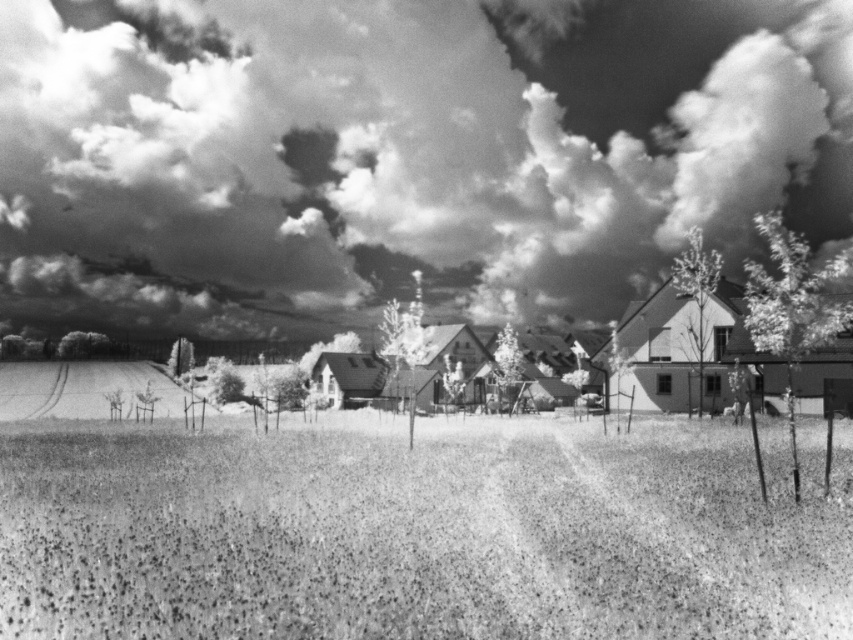
Looking at the rural landscape, you notice the cloudy sky at upper center and the grainy grass at center. Which of these two elements has a greater width in the image?

The cloudy sky at upper center has a greater width than the grainy grass at center according to the description.

You are standing in the rural landscape shown in the image. You want to estimate how far the cloudy sky at upper center is from your current position. Based on the information provided, what is the approximate distance?

The cloudy sky at upper center is approximately 121.62 meters away from the viewer.